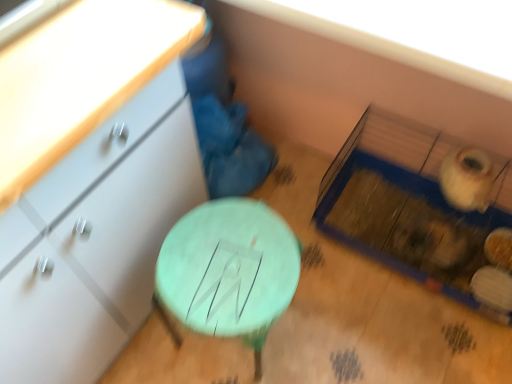
The width and height of the screenshot is (512, 384). In order to click on blank space above green painted wood stool at center (from a real-world perspective) in this screenshot , I will do `click(233, 261)`.